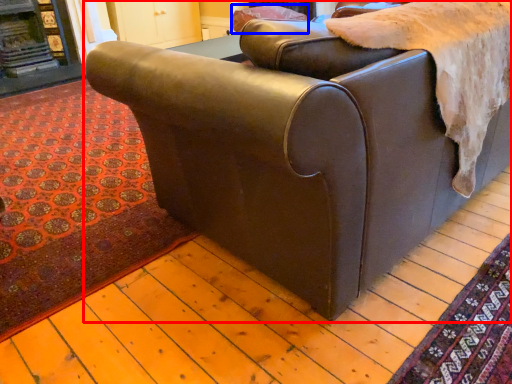
Question: Which point is further to the camera, studio couch (highlighted by a red box) or pillow (highlighted by a blue box)?

Choices:
 (A) studio couch
 (B) pillow

Answer: (B)